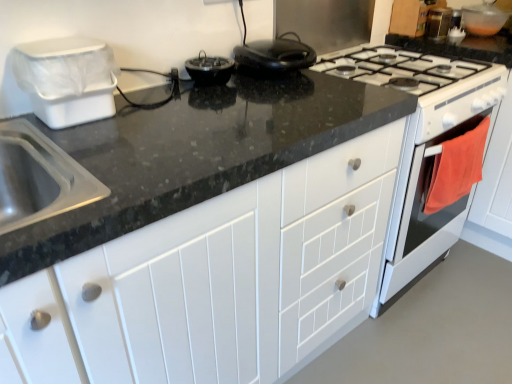
Question: From the image's perspective, is white glossy oven at right, the first oven viewed from the back, positioned above or below white glossy gas stove at upper right?

Choices:
 (A) below
 (B) above

Answer: (A)

Question: Is white glossy oven at right, which appears as the 2th oven when viewed from the front, spatially inside white glossy gas stove at upper right, or outside of it?

Choices:
 (A) outside
 (B) inside

Answer: (A)

Question: Estimate the real-world distances between objects in this image. Which object is farther from the white glossy oven at right, which appears as the 2th oven when viewed from the front?

Choices:
 (A) transparent plastic bowl at upper right, the 1th appliance from the top
 (B) white plastic bin at left, the first appliance in the bottom-to-top sequence
 (C) white glossy gas stove at upper right
 (D) white matte cabinet at center
 (E) metallic silver toaster at upper right, arranged as the 2th appliance when viewed from the right

Answer: (B)

Question: Which object is the closest to the metallic silver toaster at upper right, arranged as the 2th appliance when viewed from the right?

Choices:
 (A) orange fabric oven at right, marked as the 1th oven in a front-to-back arrangement
 (B) transparent plastic bowl at upper right, which is the first appliance in right-to-left order
 (C) white matte cabinet at center
 (D) white glossy oven at right, which appears as the 2th oven when viewed from the front
 (E) white glossy gas stove at upper right

Answer: (B)